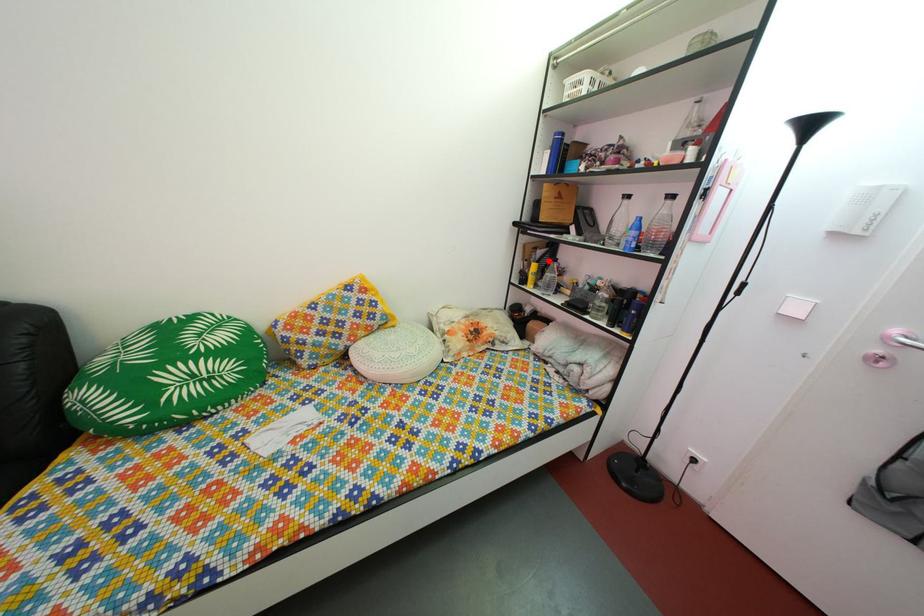
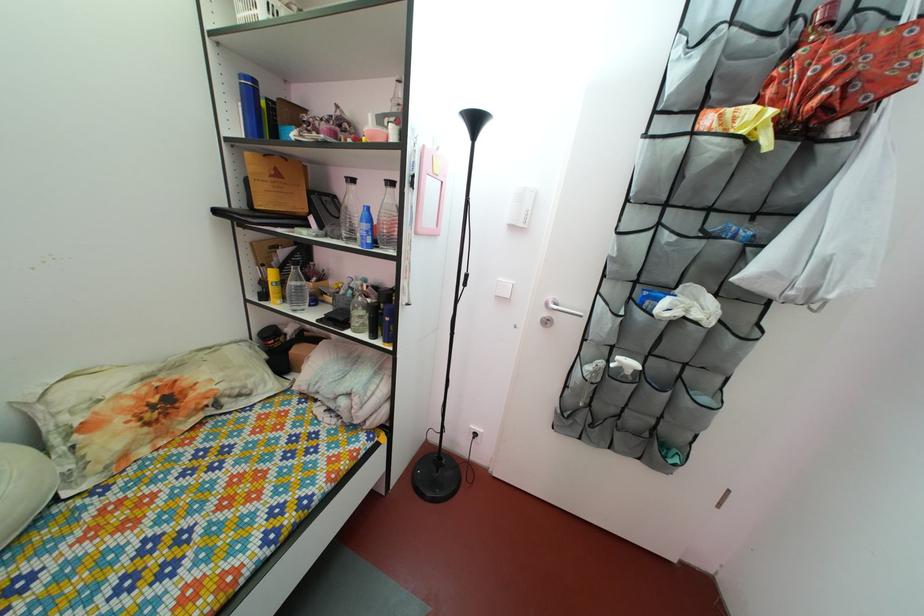
Where in the second image is the point corresponding to the highlighted location from the first image?

(292, 262)